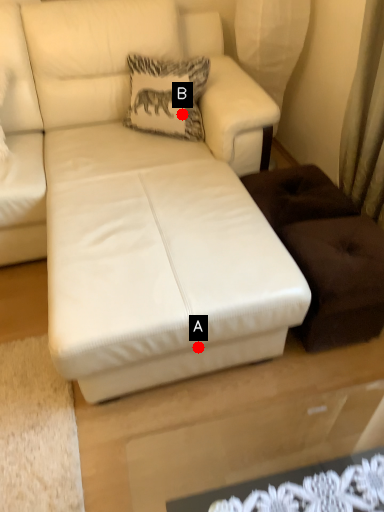
Question: Two points are circled on the image, labeled by A and B beside each circle. Which of the following is the farthest from the observer?

Choices:
 (A) A is further
 (B) B is further

Answer: (B)